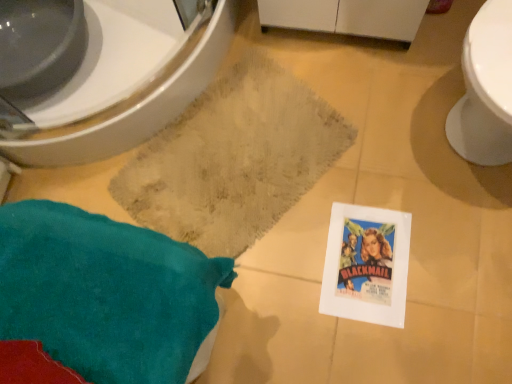
Question: From their relative heights in the image, would you say beige textured bath mat at center is taller or shorter than teal fabric throw pillow at lower left?

Choices:
 (A) tall
 (B) short

Answer: (B)

Question: In the image, is beige textured bath mat at center on the left side or the right side of teal fabric throw pillow at lower left?

Choices:
 (A) right
 (B) left

Answer: (A)

Question: Estimate the real-world distances between objects in this image. Which object is farther from the beige textured bath mat at center?

Choices:
 (A) teal fabric throw pillow at lower left
 (B) white glossy bidet at upper left

Answer: (A)

Question: Which of these objects is positioned closest to the white glossy bidet at upper left?

Choices:
 (A) beige textured bath mat at center
 (B) teal fabric throw pillow at lower left

Answer: (A)